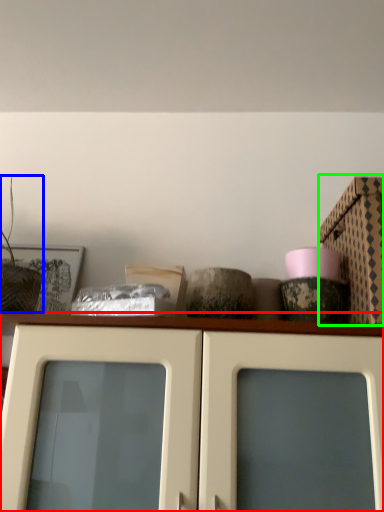
Question: Estimate the real-world distances between objects in this image. Which object is closer to cabinetry (highlighted by a red box), plant (highlighted by a blue box) or cardboard box (highlighted by a green box)?

Choices:
 (A) plant
 (B) cardboard box

Answer: (B)